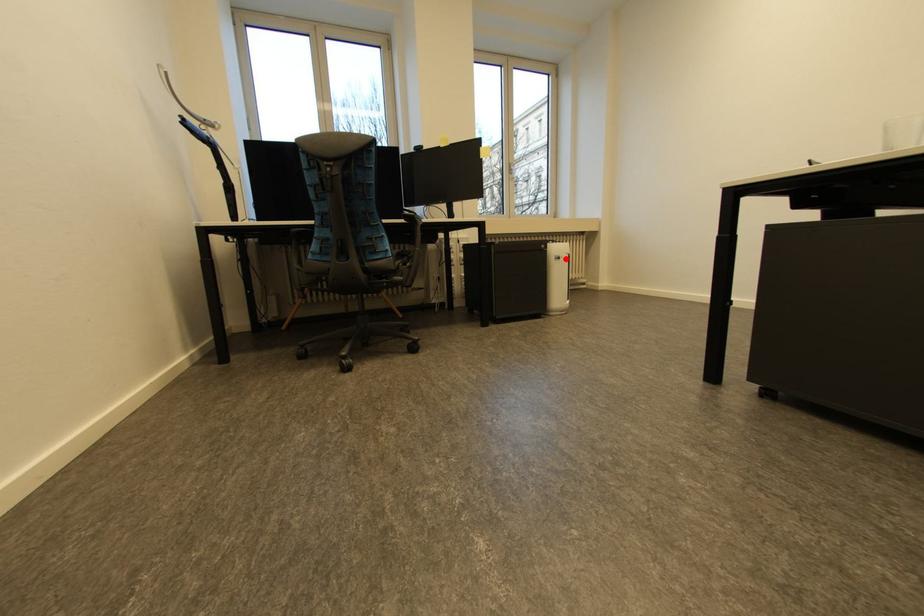
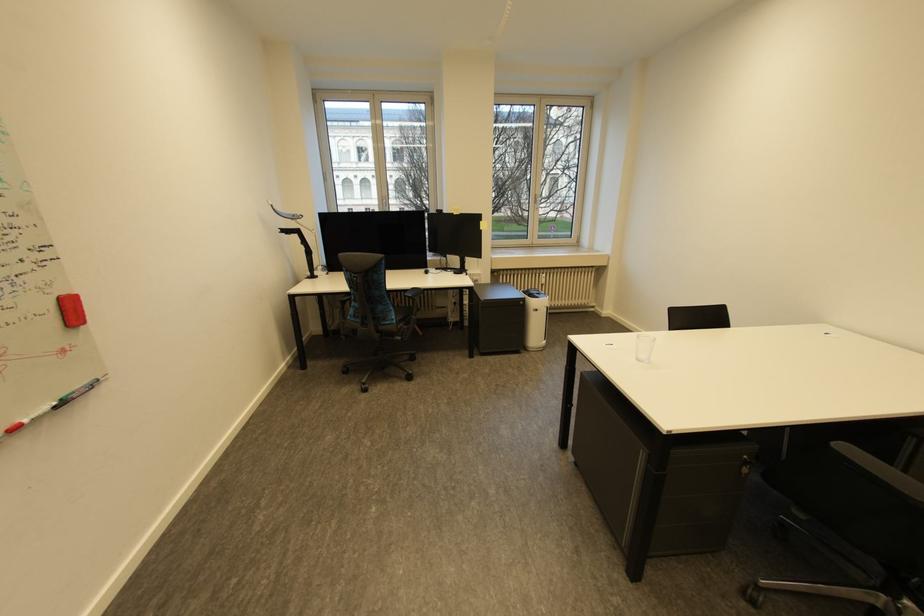
Question: I am providing you with two images of the same scene from different viewpoints. Image1 has a red point marked. In image2, the corresponding 3D location appears at what relative position? Reply with the corresponding letter.

Choices:
 (A) Closer
 (B) Farther

Answer: (B)